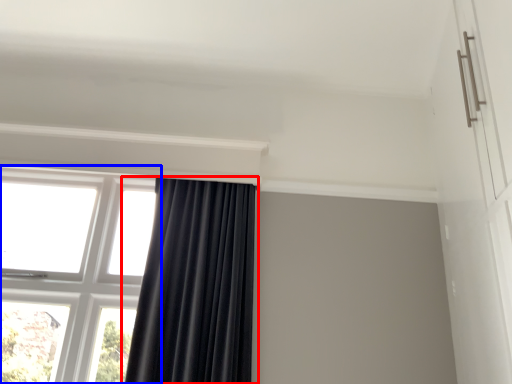
Question: Among these objects, which one is farthest to the camera, curtain (highlighted by a red box) or window (highlighted by a blue box)?

Choices:
 (A) curtain
 (B) window

Answer: (B)